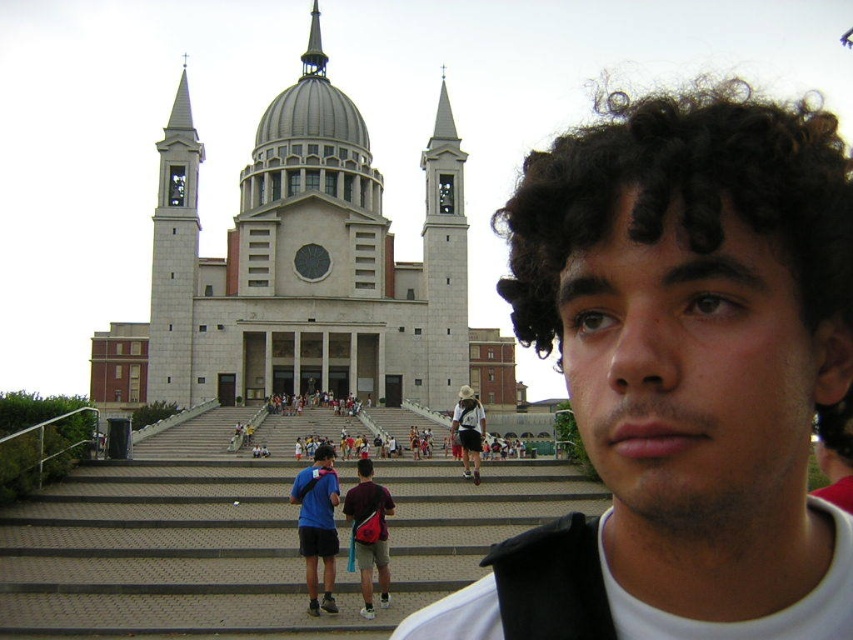
Does smooth stone tower at center have a larger size compared to blue fabric shirt at center?

Correct, smooth stone tower at center is larger in size than blue fabric shirt at center.

The image size is (853, 640). What do you see at coordinates (444, 259) in the screenshot? I see `smooth stone tower at center` at bounding box center [444, 259].

The height and width of the screenshot is (640, 853). I want to click on smooth stone tower at center, so click(444, 259).

Between smooth stone tower at center and shiny silver spire at upper center, which one is positioned lower?

smooth stone tower at center is lower down.

This screenshot has height=640, width=853. Identify the location of smooth stone tower at center. (444, 259).

Between point (450, 403) and point (311, 12), which one is positioned behind?

Positioned behind is point (311, 12).

The height and width of the screenshot is (640, 853). I want to click on smooth stone tower at center, so click(x=444, y=259).

Can you confirm if dark brown curly hair at center is positioned to the right of white stone bell tower at left?

Correct, you'll find dark brown curly hair at center to the right of white stone bell tower at left.

Describe the element at coordinates (682, 376) in the screenshot. The width and height of the screenshot is (853, 640). I see `dark brown curly hair at center` at that location.

Locate an element on the screen. dark brown curly hair at center is located at coordinates [x=682, y=376].